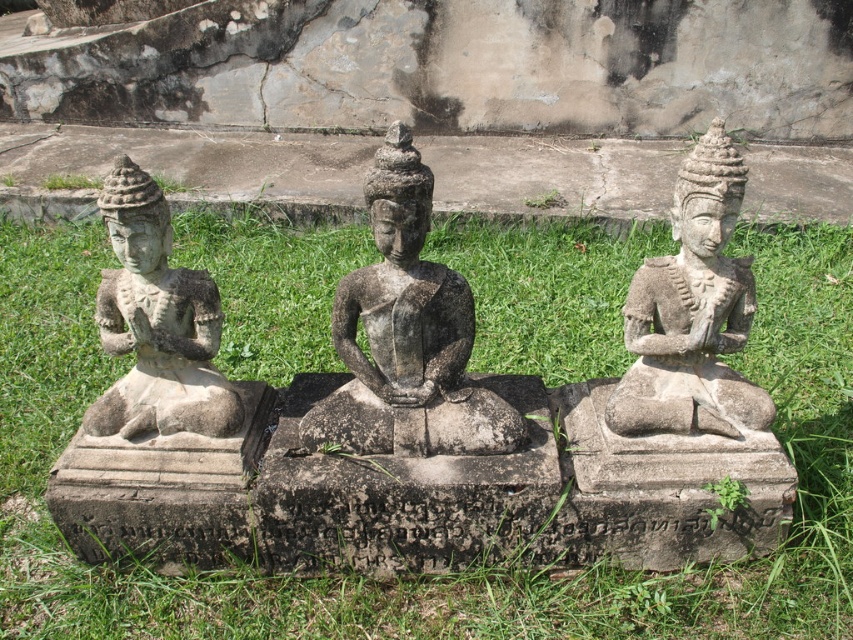
Question: Is green grass at center below gray stone statue at center?

Choices:
 (A) no
 (B) yes

Answer: (B)

Question: Which of these objects is positioned farthest from the gray stone statue at left?

Choices:
 (A) stone statue at right
 (B) green grass at center

Answer: (A)

Question: Does gray stone statue at center appear over stone statue at right?

Choices:
 (A) yes
 (B) no

Answer: (B)

Question: Among these objects, which one is nearest to the camera?

Choices:
 (A) gray stone statue at center
 (B) green grass at center

Answer: (A)

Question: Is the position of gray stone statue at center more distant than that of stone statue at right?

Choices:
 (A) no
 (B) yes

Answer: (A)

Question: Which of these objects is positioned farthest from the gray stone statue at center?

Choices:
 (A) stone statue at right
 (B) green grass at center

Answer: (B)